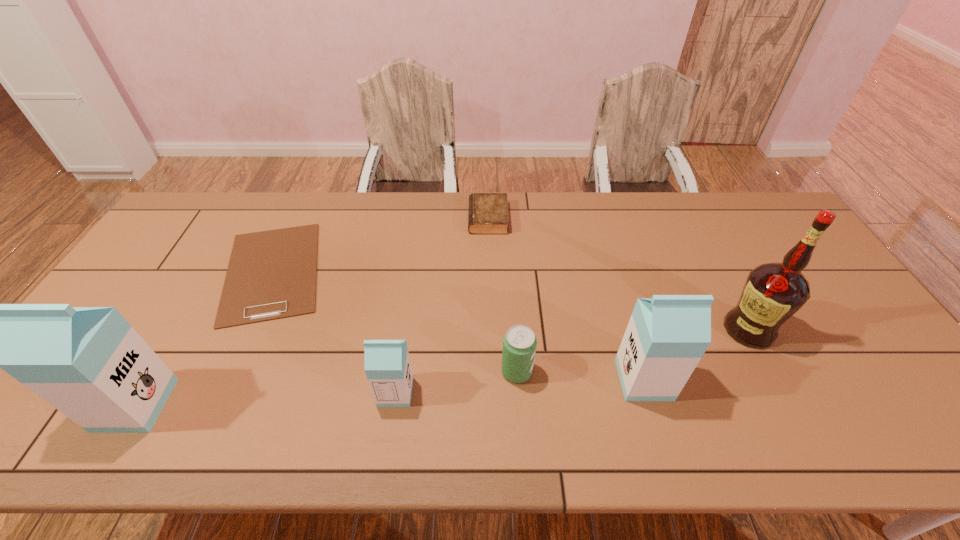
I want to click on the leftmost milk carton, so click(x=89, y=363).

Locate an element on the screen. The width and height of the screenshot is (960, 540). the fifth object from right to left is located at coordinates (387, 365).

You are a GUI agent. You are given a task and a screenshot of the screen. Output one action in this format:
    pyautogui.click(x=<x>, y=<y>)
    Task: Click on the second milk carton from left to right
    This screenshot has height=540, width=960.
    Given the screenshot: What is the action you would take?
    pyautogui.click(x=387, y=365)

Identify the location of the second tallest milk carton. (667, 335).

I want to click on the rightmost milk carton, so click(667, 335).

You are a GUI agent. You are given a task and a screenshot of the screen. Output one action in this format:
    pyautogui.click(x=<x>, y=<y>)
    Task: Click on the diary
    The image size is (960, 540).
    Given the screenshot: What is the action you would take?
    pyautogui.click(x=488, y=214)

At what (x,y) coordinates should I click in order to perform the action: click on alcohol. Please return your answer as a coordinate pair (x, y). Image resolution: width=960 pixels, height=540 pixels. Looking at the image, I should click on (773, 292).

You are a GUI agent. You are given a task and a screenshot of the screen. Output one action in this format:
    pyautogui.click(x=<x>, y=<y>)
    Task: Click on the shortest object
    The height and width of the screenshot is (540, 960).
    Given the screenshot: What is the action you would take?
    pyautogui.click(x=272, y=274)

Locate an element on the screen. the third shortest object is located at coordinates (519, 344).

Where is `free spot located 0.050m on the left of the leftmost milk carton`? free spot located 0.050m on the left of the leftmost milk carton is located at coordinates (85, 405).